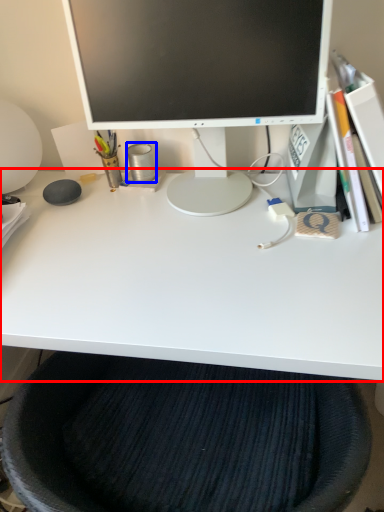
Question: Among these objects, which one is nearest to the camera, desk (highlighted by a red box) or stationery (highlighted by a blue box)?

Choices:
 (A) desk
 (B) stationery

Answer: (A)